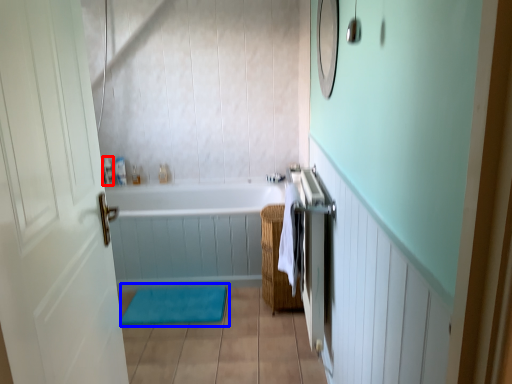
Question: Which object appears farthest to the camera in this image, toiletry (highlighted by a red box) or bath mat (highlighted by a blue box)?

Choices:
 (A) toiletry
 (B) bath mat

Answer: (A)